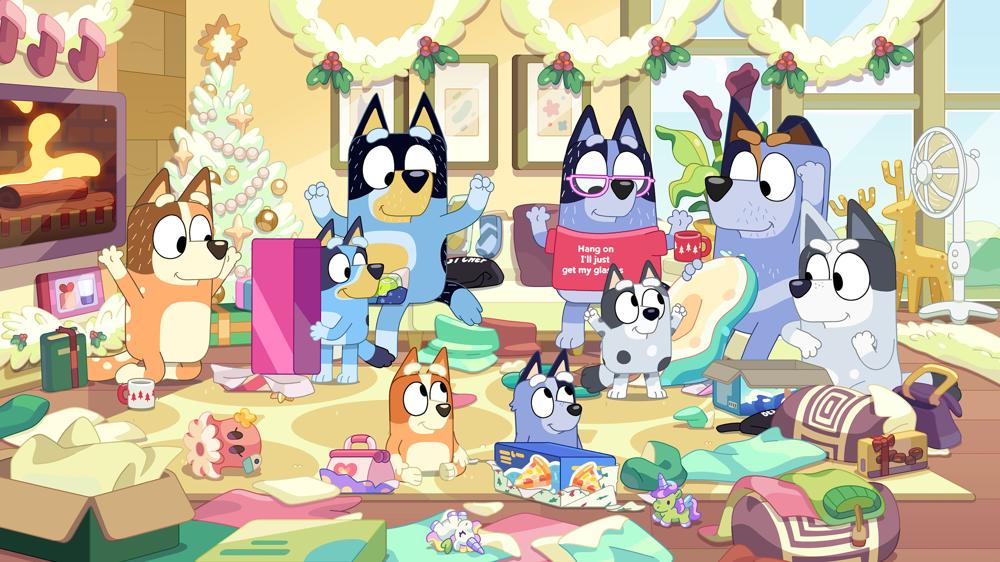
The height and width of the screenshot is (562, 1000). I want to click on fan, so click(950, 179).